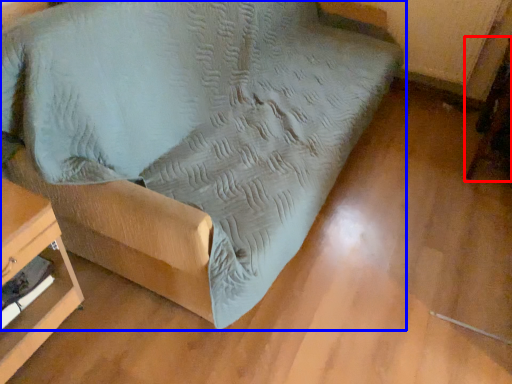
Question: Which object appears farthest to the camera in this image, swivel chair (highlighted by a red box) or furniture (highlighted by a blue box)?

Choices:
 (A) swivel chair
 (B) furniture

Answer: (A)